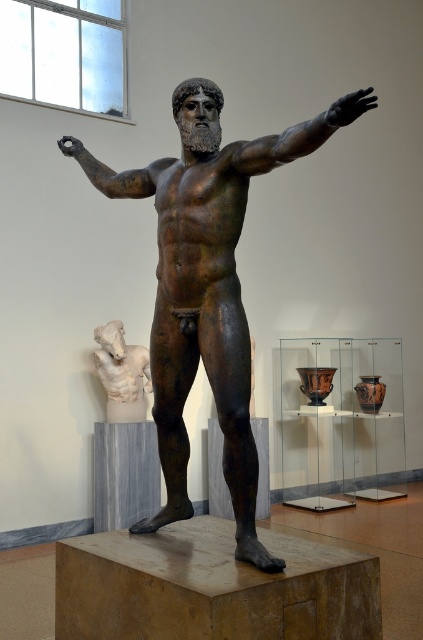
Question: Does white marble head at left have a greater width compared to bronze at upper center?

Choices:
 (A) no
 (B) yes

Answer: (A)

Question: Which point appears farthest from the camera in this image?

Choices:
 (A) coord(123,348)
 (B) coord(224,250)

Answer: (A)

Question: Which object is the closest to the white marble head at left?

Choices:
 (A) bronze statue at center
 (B) bronze muscular arm at upper center

Answer: (A)

Question: Can you confirm if white marble head at left is thinner than bronze at upper center?

Choices:
 (A) no
 (B) yes

Answer: (B)

Question: Which of the following is the farthest from the observer?

Choices:
 (A) bronze muscular arm at upper center
 (B) white marble head at left

Answer: (B)

Question: In this image, where is bronze muscular arm at upper center located relative to bronze at upper center?

Choices:
 (A) right
 (B) left

Answer: (A)